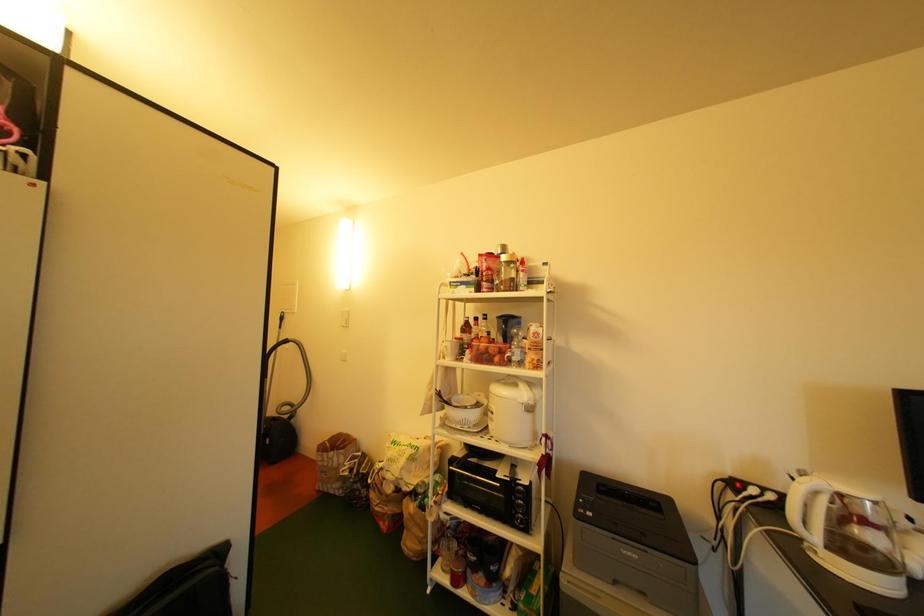
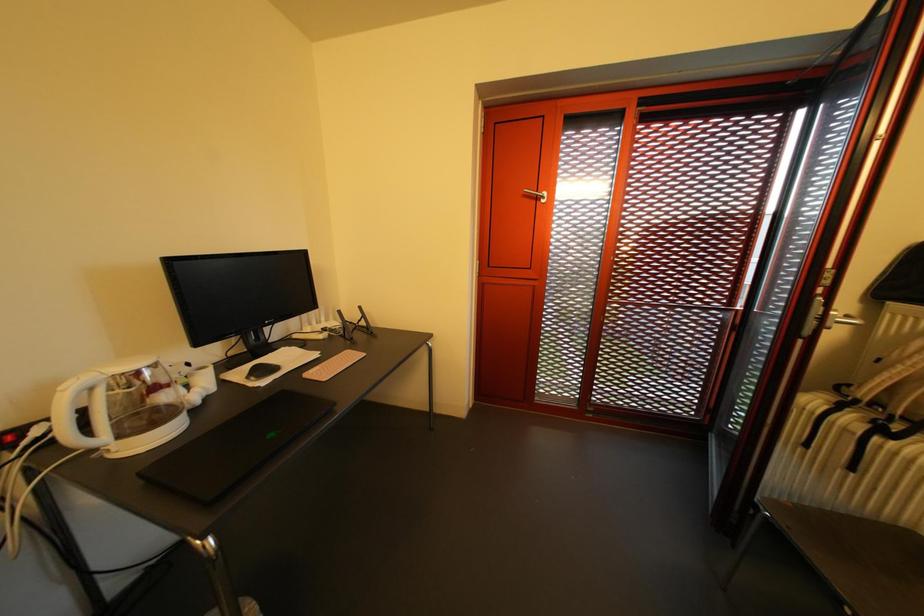
First-person continuous shooting, in which direction is the camera rotating?

The camera's rotation is toward right-down.